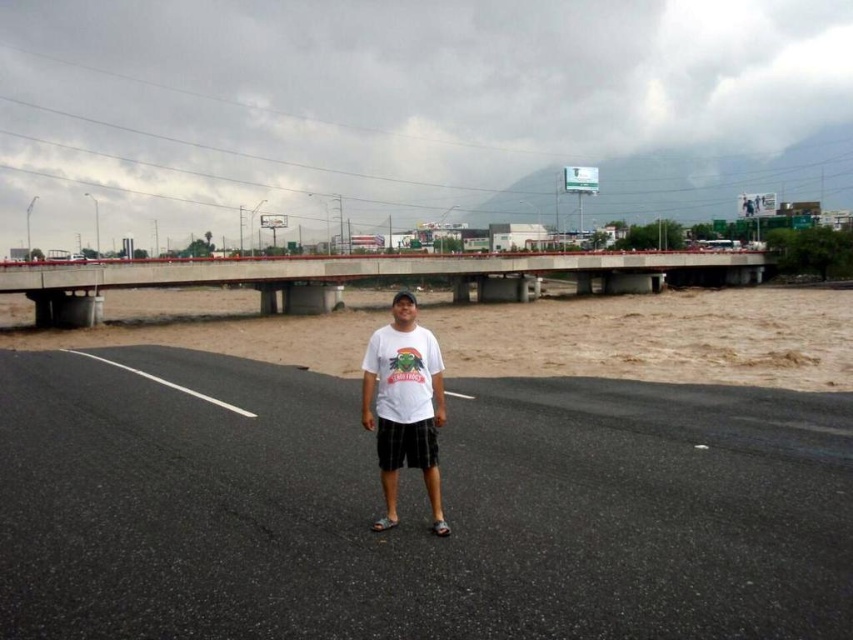
Question: Does black asphalt highway at center appear on the right side of white matte t-shirt at center?

Choices:
 (A) yes
 (B) no

Answer: (A)

Question: Which is farther from the black asphalt highway at center?

Choices:
 (A) concrete bridge at upper center
 (B) white matte t-shirt at center

Answer: (A)

Question: Does concrete bridge at upper center come in front of white matte t-shirt at center?

Choices:
 (A) no
 (B) yes

Answer: (A)

Question: Does black asphalt highway at center have a lesser width compared to concrete bridge at upper center?

Choices:
 (A) no
 (B) yes

Answer: (B)

Question: Among these objects, which one is farthest from the camera?

Choices:
 (A) concrete bridge at upper center
 (B) black asphalt highway at center

Answer: (A)

Question: Which object is the closest to the black asphalt highway at center?

Choices:
 (A) concrete bridge at upper center
 (B) white matte t-shirt at center

Answer: (B)